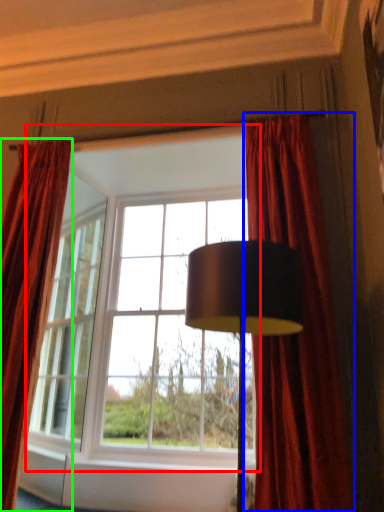
Question: Considering the real-world distances, which object is farthest from window (highlighted by a red box)? curtain (highlighted by a blue box) or curtain (highlighted by a green box)?

Choices:
 (A) curtain
 (B) curtain

Answer: (A)